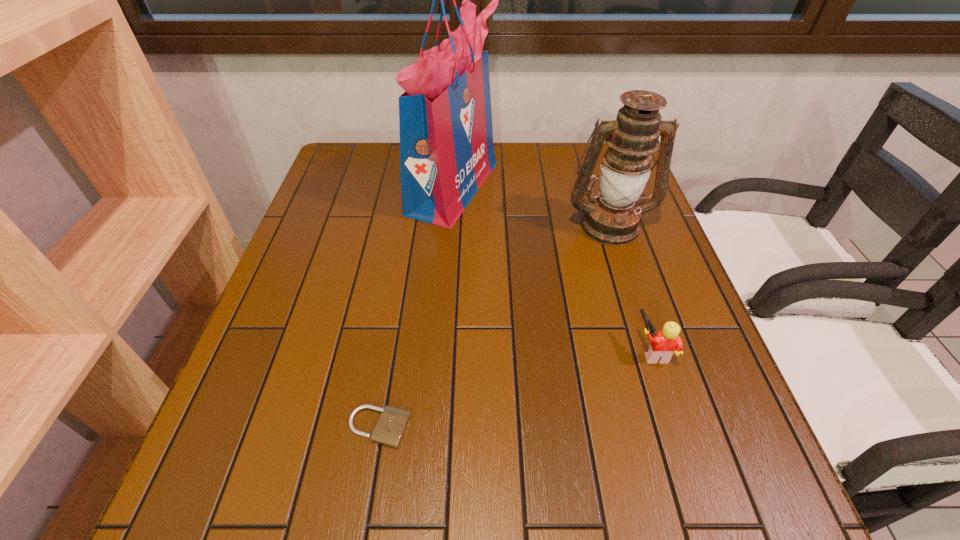
Where is `vacant position located in front of the second shortest object with the accessory visible`? The image size is (960, 540). vacant position located in front of the second shortest object with the accessory visible is located at coordinates (497, 350).

The height and width of the screenshot is (540, 960). Identify the location of vacant space located 0.390m on the back of the shortest object. (408, 256).

What are the coordinates of `object that is at the far edge` in the screenshot? It's located at (445, 119).

In order to click on lantern situated at the right edge in this screenshot , I will do `click(612, 219)`.

What are the coordinates of `Lego situated at the right edge` in the screenshot? It's located at (663, 344).

The image size is (960, 540). Find the location of `free space at the far edge of the desktop`. free space at the far edge of the desktop is located at coordinates (555, 148).

Locate an element on the screen. free space at the near edge is located at coordinates (327, 490).

Identify the location of vacant space at the left edge. (318, 324).

What are the coordinates of `vacant area at the right edge` in the screenshot? It's located at (633, 341).

This screenshot has width=960, height=540. Find the location of `free space at the near left corner of the desktop`. free space at the near left corner of the desktop is located at coordinates (257, 525).